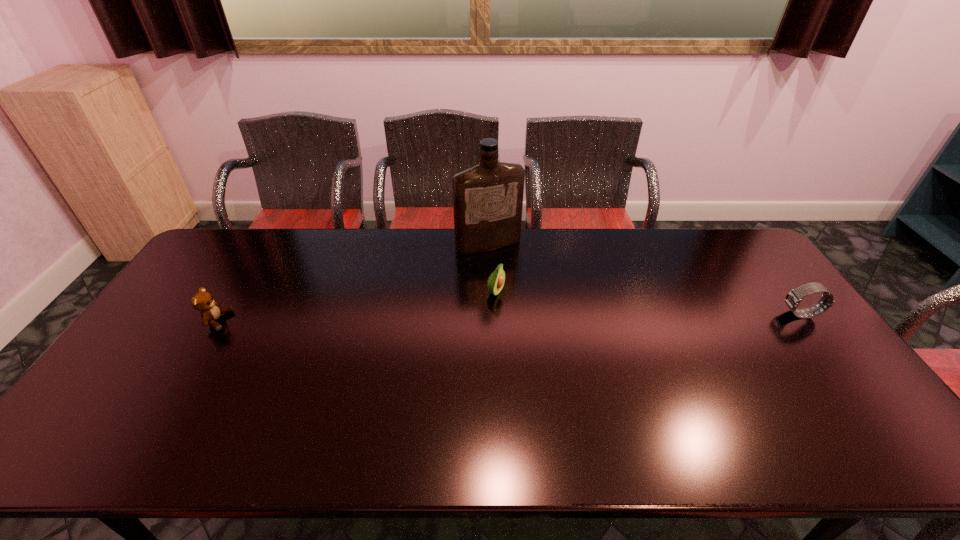
Image resolution: width=960 pixels, height=540 pixels. I want to click on free space between the third nearest object and the tallest object, so click(x=492, y=269).

Find the location of a particular element. This screenshot has width=960, height=540. empty space that is in between the teddy bear and the avocado is located at coordinates (356, 307).

Locate an element on the screen. free space between the farthest object and the avocado is located at coordinates (492, 269).

You are a GUI agent. You are given a task and a screenshot of the screen. Output one action in this format:
    pyautogui.click(x=<x>, y=<y>)
    Task: Click on the vacant point located between the liquor and the third nearest object
    This screenshot has height=540, width=960.
    Given the screenshot: What is the action you would take?
    pyautogui.click(x=492, y=269)

You are a GUI agent. You are given a task and a screenshot of the screen. Output one action in this format:
    pyautogui.click(x=<x>, y=<y>)
    Task: Click on the object that is the closest to the second farthest object
    Image resolution: width=960 pixels, height=540 pixels.
    Given the screenshot: What is the action you would take?
    pyautogui.click(x=488, y=198)

Locate which object is the second closest to the watch. Please provide its 2D coordinates. Your answer should be formatted as a tuple, i.e. [(x, y)], where the tuple contains the x and y coordinates of a point satisfying the conditions above.

[(496, 281)]

Find the location of a particular element. This screenshot has width=960, height=540. free space that satisfies the following two spatial constraints: 1. on the front side of the farthest object; 2. on the face of the watch is located at coordinates (490, 314).